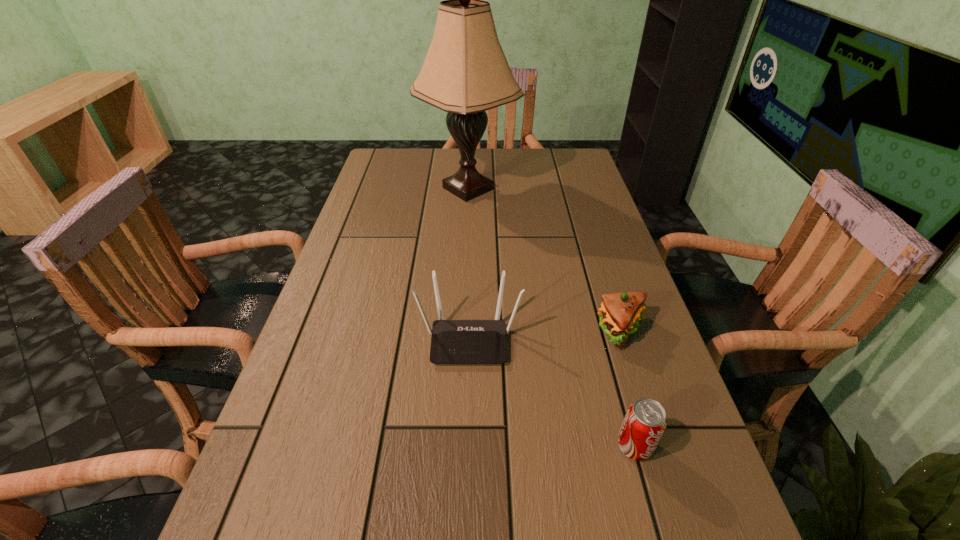
Find the location of `sandwich that is positioned at the right edge`. sandwich that is positioned at the right edge is located at coordinates (620, 314).

You are a GUI agent. You are given a task and a screenshot of the screen. Output one action in this format:
    pyautogui.click(x=<x>, y=<y>)
    Task: Click on the soda that is at the right edge
    This screenshot has height=540, width=960.
    Given the screenshot: What is the action you would take?
    pyautogui.click(x=645, y=421)

The height and width of the screenshot is (540, 960). What are the coordinates of `free space at the far edge of the desktop` in the screenshot? It's located at (496, 171).

In the image, there is a desktop. Find the location of `vacant space at the left edge`. vacant space at the left edge is located at coordinates (379, 226).

Where is `free space at the right edge of the desktop`? free space at the right edge of the desktop is located at coordinates (599, 394).

At what (x,y) coordinates should I click in order to perform the action: click on free space at the far left corner of the desktop. Please return your answer as a coordinate pair (x, y). Looking at the image, I should click on (407, 172).

You are a GUI agent. You are given a task and a screenshot of the screen. Output one action in this format:
    pyautogui.click(x=<x>, y=<y>)
    Task: Click on the free space between the sandwich and the lamp
    
    Given the screenshot: What is the action you would take?
    pyautogui.click(x=544, y=260)

Where is `empty space between the sandwich and the soda`? empty space between the sandwich and the soda is located at coordinates (x=628, y=389).

What are the coordinates of `empty location between the sandwich and the router` in the screenshot? It's located at (545, 335).

Where is `unoccupied position between the sandwich and the soda`? unoccupied position between the sandwich and the soda is located at coordinates (628, 389).